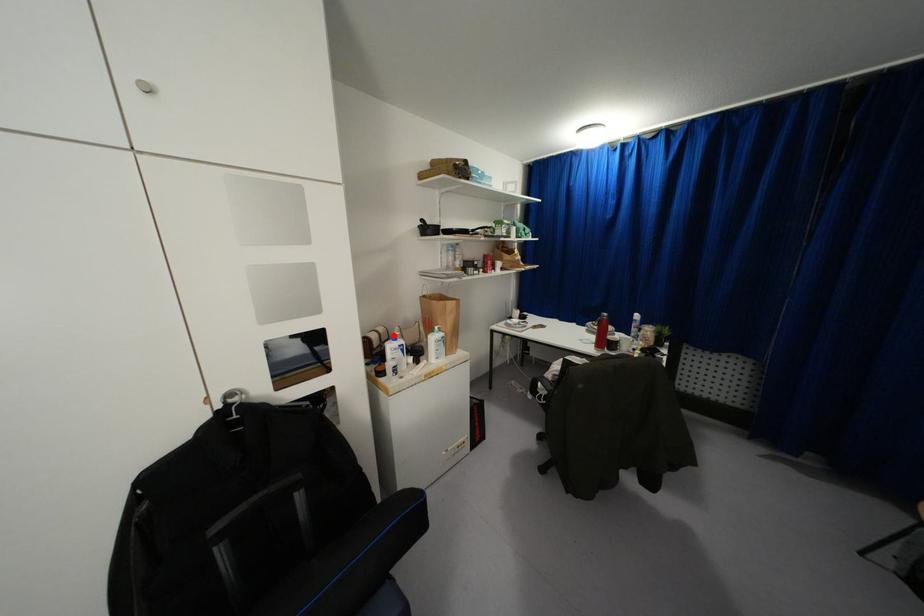
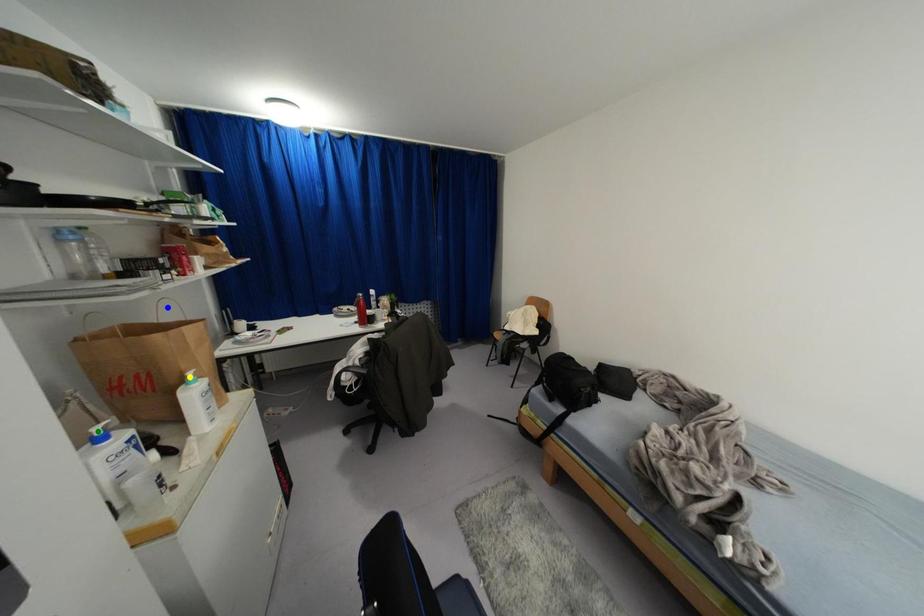
Question: I am providing you with two images of the same scene from different viewpoints. A red point is marked on the first image. You are given multiple points on the second image. Which spot in image 2 lines up with the point in image 1?

Choices:
 (A) green point
 (B) blue point
 (C) yellow point

Answer: (A)